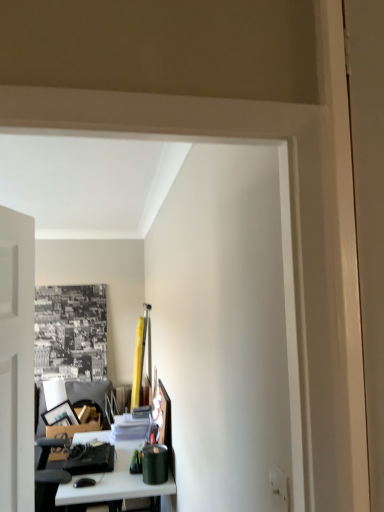
Question: Should I look upward or downward to see white glossy table at lower left?

Choices:
 (A) up
 (B) down

Answer: (B)

Question: Can you confirm if green matte canister at lower center, acting as the 2th stationery starting from the left, is bigger than white glossy table at lower left?

Choices:
 (A) no
 (B) yes

Answer: (A)

Question: Can you confirm if green matte canister at lower center, the first stationery from the front, is positioned to the left of white glossy table at lower left?

Choices:
 (A) yes
 (B) no

Answer: (B)

Question: Can you confirm if green matte canister at lower center, acting as the 2th stationery starting from the left, is smaller than white glossy table at lower left?

Choices:
 (A) yes
 (B) no

Answer: (A)

Question: Is white glossy table at lower left completely or partially inside green matte canister at lower center, which is the second stationery from back to front?

Choices:
 (A) yes
 (B) no

Answer: (B)

Question: Considering the relative positions of green matte canister at lower center, the first stationery from the front, and white glossy table at lower left in the image provided, is green matte canister at lower center, the first stationery from the front, in front of white glossy table at lower left?

Choices:
 (A) yes
 (B) no

Answer: (B)

Question: From the image's perspective, does green matte canister at lower center, the first stationery from the front, appear lower than white glossy table at lower left?

Choices:
 (A) yes
 (B) no

Answer: (B)

Question: From a real-world perspective, does matte black stationery at lower left, which is counted as the first stationery, starting from the back, sit lower than green matte canister at lower center, acting as the first stationery starting from the right?

Choices:
 (A) no
 (B) yes

Answer: (B)

Question: Could you tell me if matte black stationery at lower left, which is counted as the first stationery, starting from the back, is turned towards green matte canister at lower center, which is the second stationery from back to front?

Choices:
 (A) no
 (B) yes

Answer: (A)

Question: From the image's perspective, is matte black stationery at lower left, arranged as the 1th stationery when viewed from the left, located above green matte canister at lower center, which is the second stationery from back to front?

Choices:
 (A) yes
 (B) no

Answer: (B)

Question: From a real-world perspective, is matte black stationery at lower left, arranged as the 1th stationery when viewed from the left, on green matte canister at lower center, acting as the 2th stationery starting from the left?

Choices:
 (A) no
 (B) yes

Answer: (A)

Question: Is green matte canister at lower center, which is the second stationery from back to front, inside matte black stationery at lower left, arranged as the 1th stationery when viewed from the left?

Choices:
 (A) no
 (B) yes

Answer: (A)

Question: Does matte black stationery at lower left, arranged as the second stationery when viewed from the front, have a larger size compared to green matte canister at lower center, the first stationery from the front?

Choices:
 (A) no
 (B) yes

Answer: (B)

Question: Can you confirm if matte black stationery at lower left, arranged as the 1th stationery when viewed from the left, is smaller than white glossy table at lower left?

Choices:
 (A) no
 (B) yes

Answer: (B)